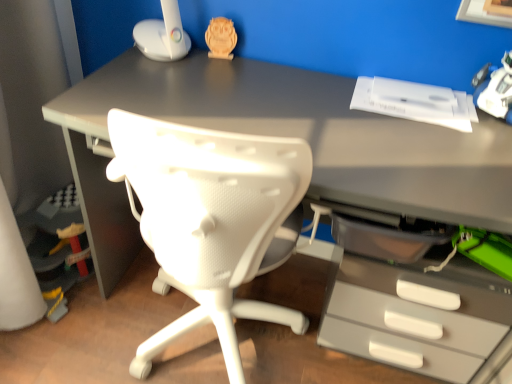
Question: From the image's perspective, relative to white plastic toy at upper right, the 1th toy when ordered from front to back, is wooden owl at upper center, which is counted as the second toy, starting from the right, above or below?

Choices:
 (A) below
 (B) above

Answer: (B)

Question: Is point (223, 54) closer or farther from the camera than point (486, 100)?

Choices:
 (A) closer
 (B) farther

Answer: (B)

Question: In the image, is wooden owl at upper center, positioned as the 2th toy in front-to-back order, positioned in front of or behind white plastic toy at upper right, the second toy in the back-to-front sequence?

Choices:
 (A) behind
 (B) front

Answer: (A)

Question: Visually, is white plastic toy at upper right, the 1th toy when ordered from right to left, positioned to the left or to the right of wooden owl at upper center, which is the 1th toy from back to front?

Choices:
 (A) right
 (B) left

Answer: (A)

Question: From their relative heights in the image, would you say white plastic toy at upper right, the 1th toy when ordered from right to left, is taller or shorter than wooden owl at upper center, which is the 1th toy from back to front?

Choices:
 (A) tall
 (B) short

Answer: (A)

Question: Does point (492, 92) appear closer or farther from the camera than point (231, 31)?

Choices:
 (A) closer
 (B) farther

Answer: (A)

Question: From the image's perspective, is white plastic toy at upper right, which is counted as the second toy, starting from the top, positioned above or below wooden owl at upper center, which is the 1th toy from top to bottom?

Choices:
 (A) below
 (B) above

Answer: (A)